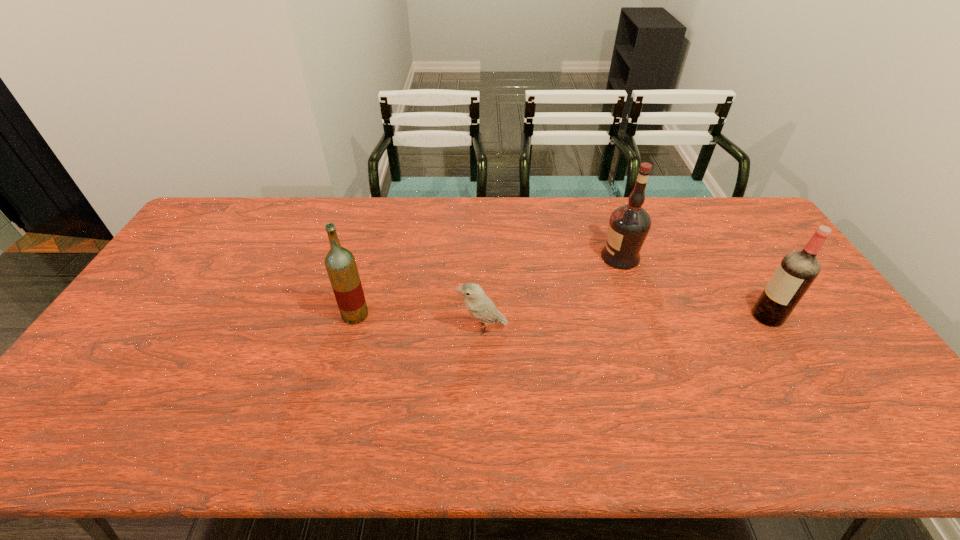
Find the location of a particular element. The image size is (960, 540). free location located on the front-facing side of the rightmost liquor is located at coordinates (630, 316).

At what (x,y) coordinates should I click in order to perform the action: click on vacant area situated 0.400m on the front-facing side of the rightmost liquor. Please return your answer as a coordinate pair (x, y). Image resolution: width=960 pixels, height=540 pixels. Looking at the image, I should click on (612, 316).

Locate an element on the screen. vacant position located 0.390m on the front-facing side of the rightmost liquor is located at coordinates (615, 316).

This screenshot has height=540, width=960. What are the coordinates of `vacant area situated at the face of the shortest object` in the screenshot? It's located at (366, 327).

Locate an element on the screen. vacant space located at the face of the shortest object is located at coordinates (319, 327).

Locate an element on the screen. This screenshot has width=960, height=540. free space located at the face of the shortest object is located at coordinates (409, 327).

Identify the location of object located in the right edge section of the desktop. This screenshot has width=960, height=540. (797, 271).

You are a GUI agent. You are given a task and a screenshot of the screen. Output one action in this format:
    pyautogui.click(x=<x>, y=<y>)
    Task: Click on the vacant space at the far edge of the desktop
    This screenshot has width=960, height=540.
    Given the screenshot: What is the action you would take?
    pyautogui.click(x=496, y=230)

Where is `vacant region at the near edge of the desktop`? The width and height of the screenshot is (960, 540). vacant region at the near edge of the desktop is located at coordinates (386, 453).

At what (x,y) coordinates should I click in order to perform the action: click on free space at the left edge. Please return your answer as a coordinate pair (x, y). This screenshot has width=960, height=540. Looking at the image, I should click on (154, 289).